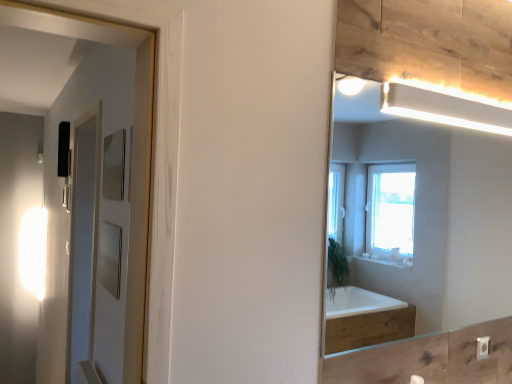
Question: From a real-world perspective, is transparent glass screen door at left positioned under clear glass mirror at upper right based on gravity?

Choices:
 (A) yes
 (B) no

Answer: (A)

Question: Is transparent glass screen door at left further to the viewer compared to clear glass mirror at upper right?

Choices:
 (A) yes
 (B) no

Answer: (A)

Question: Is transparent glass screen door at left aimed at clear glass mirror at upper right?

Choices:
 (A) yes
 (B) no

Answer: (B)

Question: From the image's perspective, is transparent glass screen door at left over clear glass mirror at upper right?

Choices:
 (A) no
 (B) yes

Answer: (A)

Question: Considering the relative sizes of transparent glass screen door at left and clear glass mirror at upper right in the image provided, is transparent glass screen door at left shorter than clear glass mirror at upper right?

Choices:
 (A) yes
 (B) no

Answer: (B)

Question: Is clear glass mirror at upper right inside transparent glass screen door at left?

Choices:
 (A) yes
 (B) no

Answer: (B)

Question: Is clear glass mirror at upper right at the left side of transparent glass screen door at left?

Choices:
 (A) no
 (B) yes

Answer: (A)

Question: Could you tell me if clear glass mirror at upper right is facing transparent glass screen door at left?

Choices:
 (A) yes
 (B) no

Answer: (B)

Question: Does clear glass mirror at upper right have a lesser height compared to transparent glass screen door at left?

Choices:
 (A) no
 (B) yes

Answer: (B)

Question: Is clear glass mirror at upper right oriented away from transparent glass screen door at left?

Choices:
 (A) yes
 (B) no

Answer: (A)

Question: From the image's perspective, is clear glass mirror at upper right below transparent glass screen door at left?

Choices:
 (A) yes
 (B) no

Answer: (B)

Question: From the image's perspective, is clear glass mirror at upper right on transparent glass screen door at left?

Choices:
 (A) no
 (B) yes

Answer: (B)

Question: In the image, is clear glass mirror at upper right positioned in front of or behind transparent glass screen door at left?

Choices:
 (A) front
 (B) behind

Answer: (A)